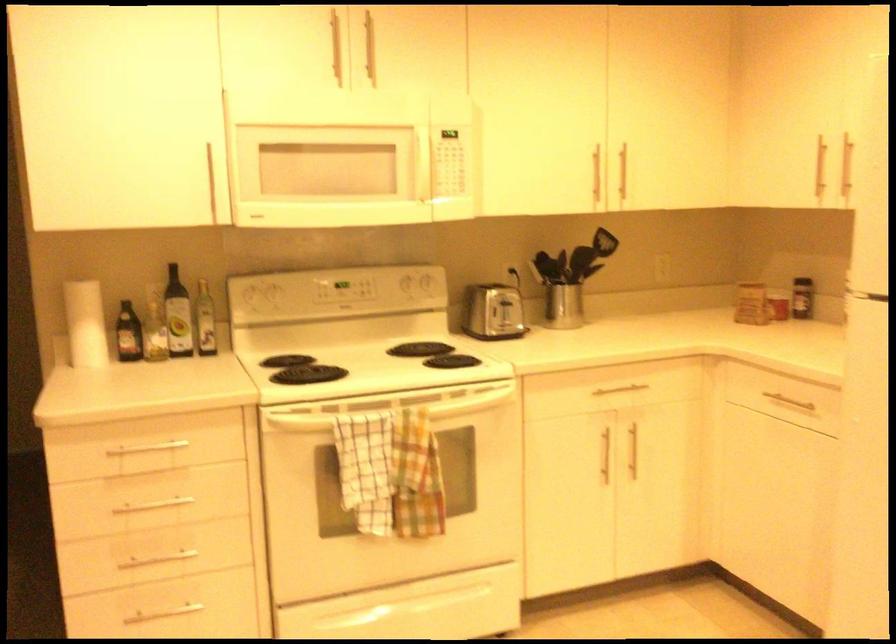
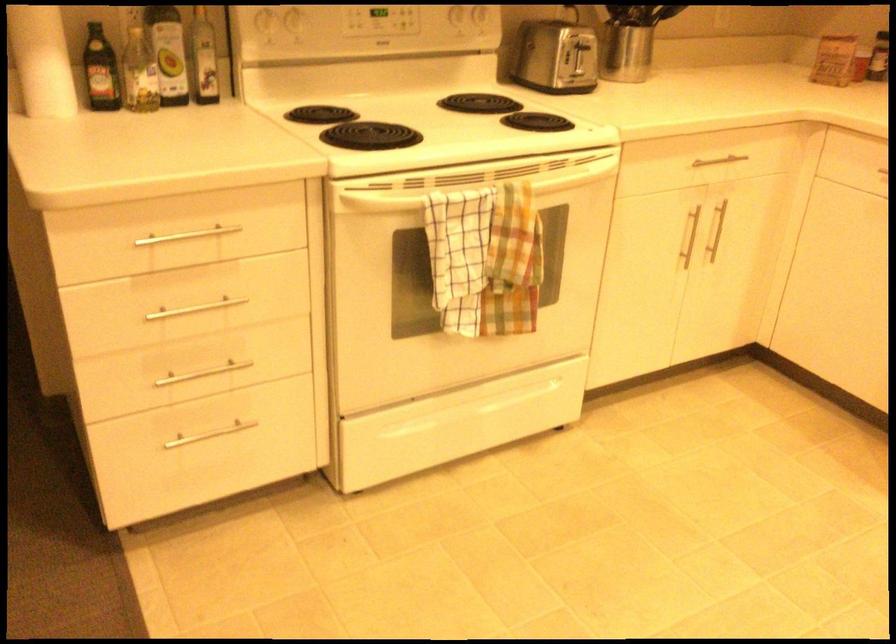
Find the pixel in the second image that matches point (501, 321) in the first image.

(572, 73)